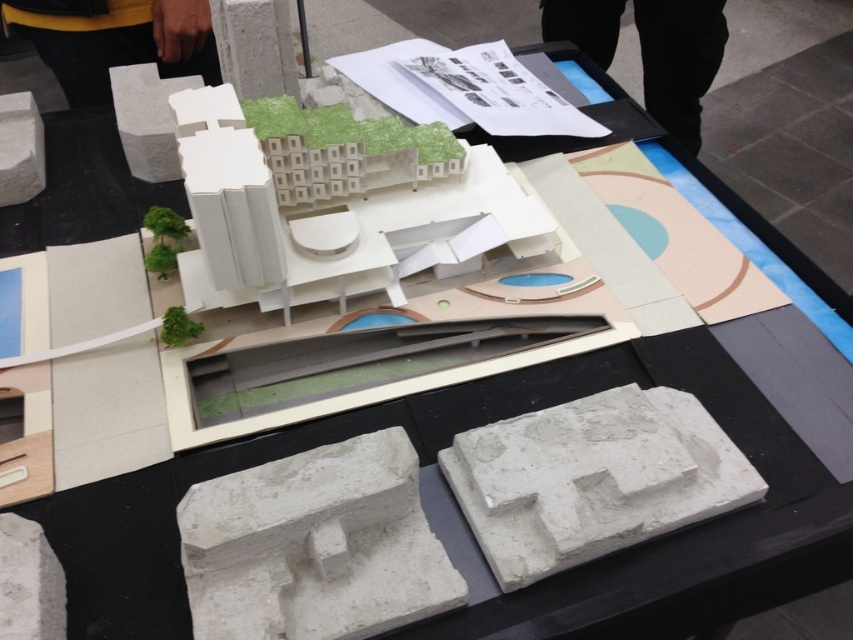
Who is taller, white concrete block at lower left or white concrete block at upper left?

Standing taller between the two is white concrete block at upper left.

Which is above, white concrete block at lower left or white concrete block at upper left?

white concrete block at upper left is higher up.

Who is more distant from viewer, (16, 602) or (32, 188)?

The point (32, 188) is more distant.

Find the location of a particular element. white concrete block at lower left is located at coordinates (28, 582).

Can you confirm if white concrete block at center is wider than white concrete block at lower left?

Yes.

This screenshot has height=640, width=853. What do you see at coordinates (592, 477) in the screenshot?
I see `white concrete block at center` at bounding box center [592, 477].

Does point (682, 433) come farther from viewer compared to point (45, 589)?

That is True.

I want to click on white concrete block at center, so click(592, 477).

Is black pants at upper center positioned in front of white concrete block at upper left?

No, it is behind white concrete block at upper left.

Is black pants at upper center wider than white concrete block at upper left?

Indeed, black pants at upper center has a greater width compared to white concrete block at upper left.

Describe the element at coordinates (679, 60) in the screenshot. I see `black pants at upper center` at that location.

Find the location of a particular element. black pants at upper center is located at coordinates (679, 60).